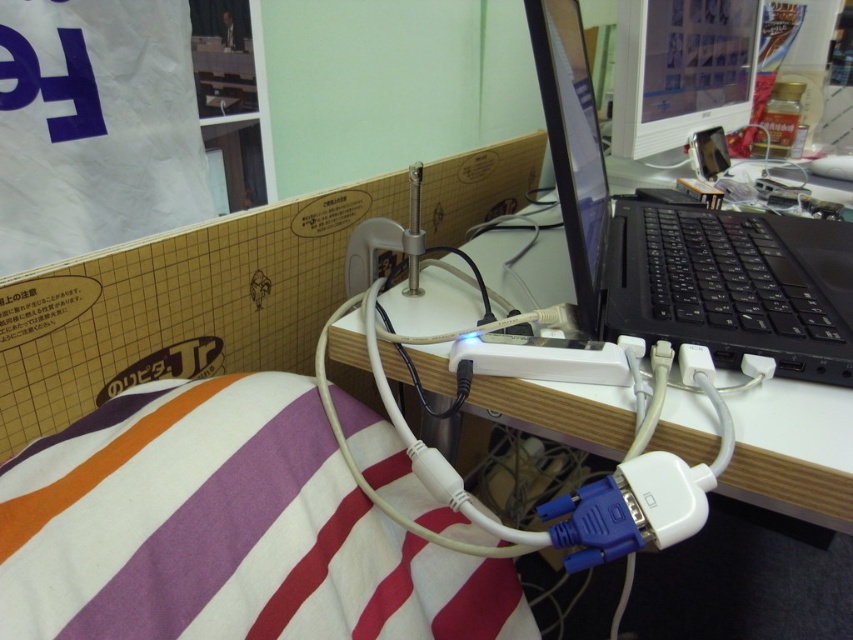
Question: Which object is the closest to the white plastic computer desk at center?

Choices:
 (A) black plastic laptop at center
 (B) white striped blanket at lower left
 (C) matte black monitor at upper center

Answer: (A)

Question: Among these objects, which one is farthest from the camera?

Choices:
 (A) black plastic laptop at center
 (B) white plastic computer desk at center
 (C) matte black monitor at upper center

Answer: (C)

Question: Which object is farther from the camera taking this photo?

Choices:
 (A) black plastic laptop at center
 (B) white striped blanket at lower left
 (C) matte black monitor at upper center

Answer: (C)

Question: Can you confirm if black plastic laptop at center is wider than white plastic computer desk at center?

Choices:
 (A) yes
 (B) no

Answer: (A)

Question: Can you confirm if white striped blanket at lower left is thinner than black plastic laptop at center?

Choices:
 (A) no
 (B) yes

Answer: (B)

Question: Is the position of white striped blanket at lower left less distant than that of black plastic laptop at center?

Choices:
 (A) no
 (B) yes

Answer: (B)